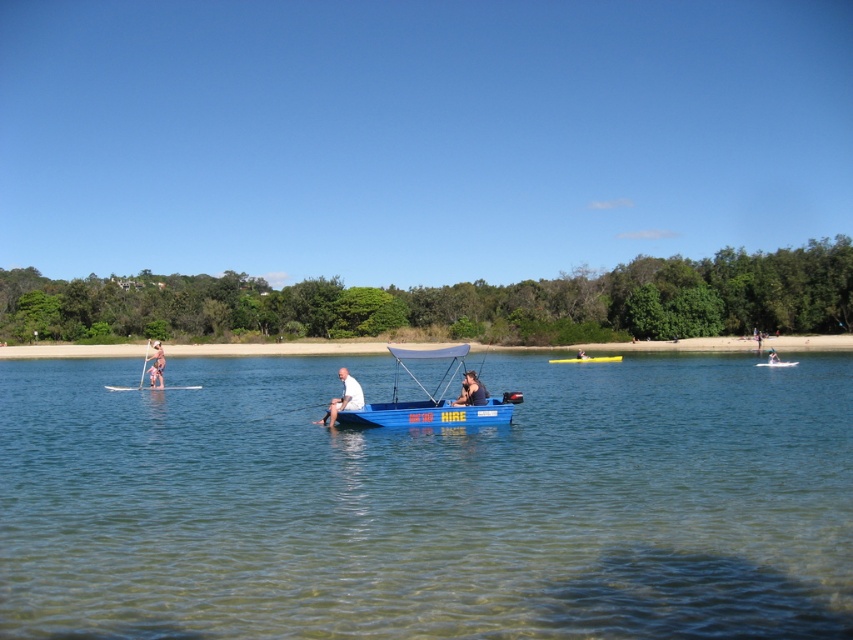
Who is shorter, dark blue fabric boat at center or yellow plastic canoe at center?

yellow plastic canoe at center

Does point (479, 403) lie in front of point (604, 360)?

That is True.

I want to click on dark blue fabric boat at center, so click(x=471, y=390).

Is point (128, 390) positioned after point (584, 353)?

No, (128, 390) is in front of (584, 353).

Between point (196, 387) and point (579, 356), which one is positioned in front?

Point (196, 387) is more forward.

Find the location of a particular element. white foam paddle at left is located at coordinates (149, 387).

The height and width of the screenshot is (640, 853). What do you see at coordinates (434, 397) in the screenshot?
I see `blue plastic boat at center` at bounding box center [434, 397].

Based on the photo, who is higher up, blue plastic boat at center or white fabric boat at center?

Positioned higher is white fabric boat at center.

Is point (393, 387) farther from camera compared to point (343, 376)?

Yes.

Identify the location of blue plastic boat at center. The width and height of the screenshot is (853, 640). (434, 397).